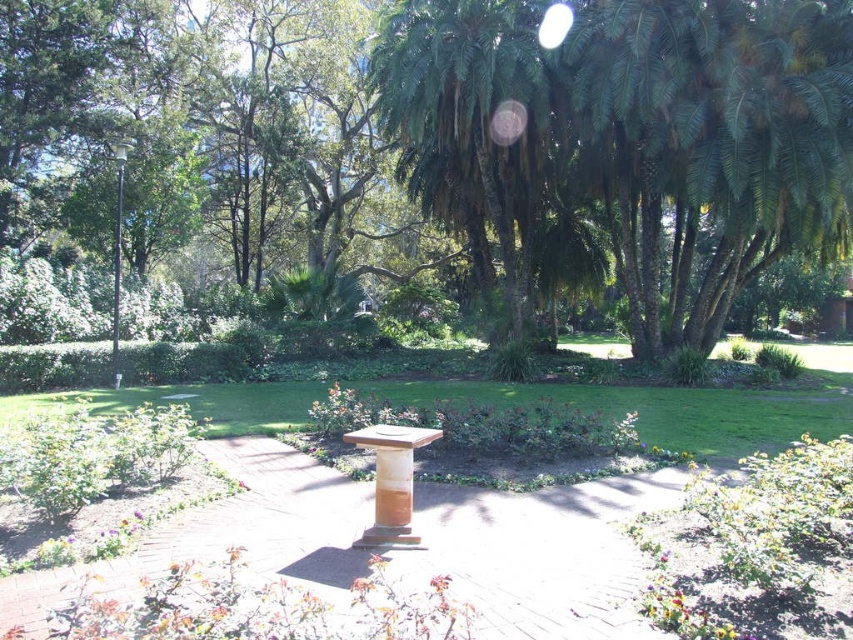
Question: Considering the relative positions of green leafy tree at center and wooden pedestal at center in the image provided, where is green leafy tree at center located with respect to wooden pedestal at center?

Choices:
 (A) above
 (B) below

Answer: (A)

Question: Considering the relative positions of green leafy tree at center and black metal pole at left in the image provided, where is green leafy tree at center located with respect to black metal pole at left?

Choices:
 (A) left
 (B) right

Answer: (B)

Question: Can you confirm if green leafy tree at center is positioned to the right of black metal pole at left?

Choices:
 (A) yes
 (B) no

Answer: (A)

Question: Which point is farther to the camera?

Choices:
 (A) (192, 538)
 (B) (117, 349)

Answer: (B)

Question: Which object is the closest to the black metal pole at left?

Choices:
 (A) wooden pedestal at center
 (B) green leafy tree at center
 (C) brown wooden path at center

Answer: (B)

Question: Which point is farther from the camera taking this photo?

Choices:
 (A) (410, 460)
 (B) (657, 3)
 (C) (119, 291)
 (D) (260, 497)

Answer: (C)